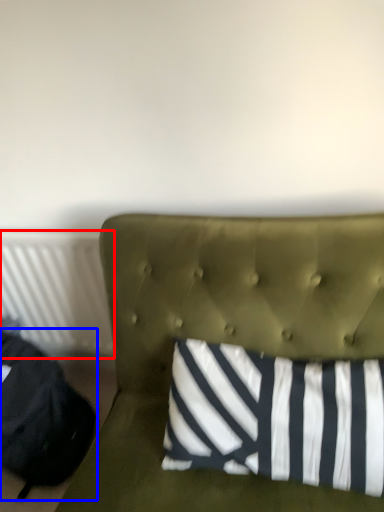
Question: Which object is closer to the camera taking this photo, radiator (highlighted by a red box) or bean bag chair (highlighted by a blue box)?

Choices:
 (A) radiator
 (B) bean bag chair

Answer: (B)